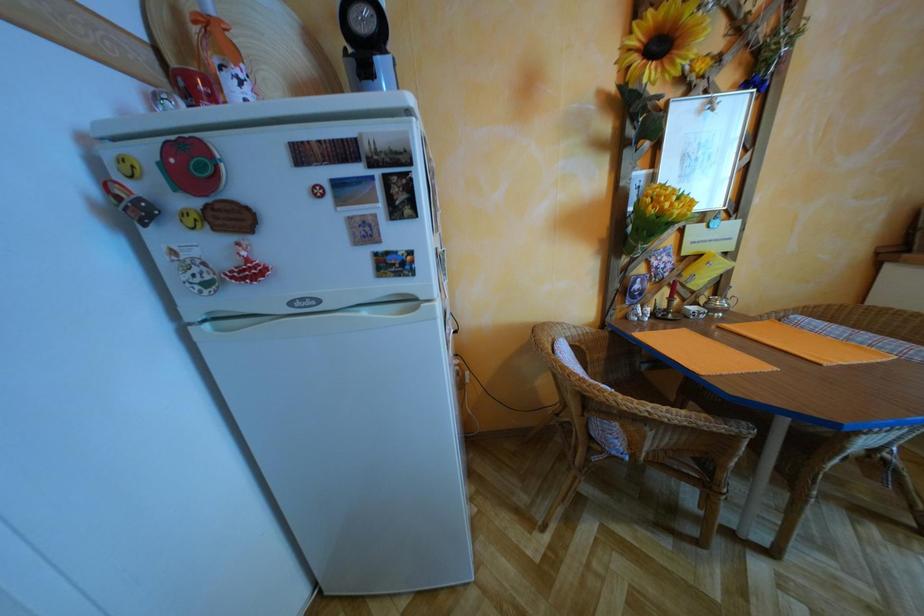
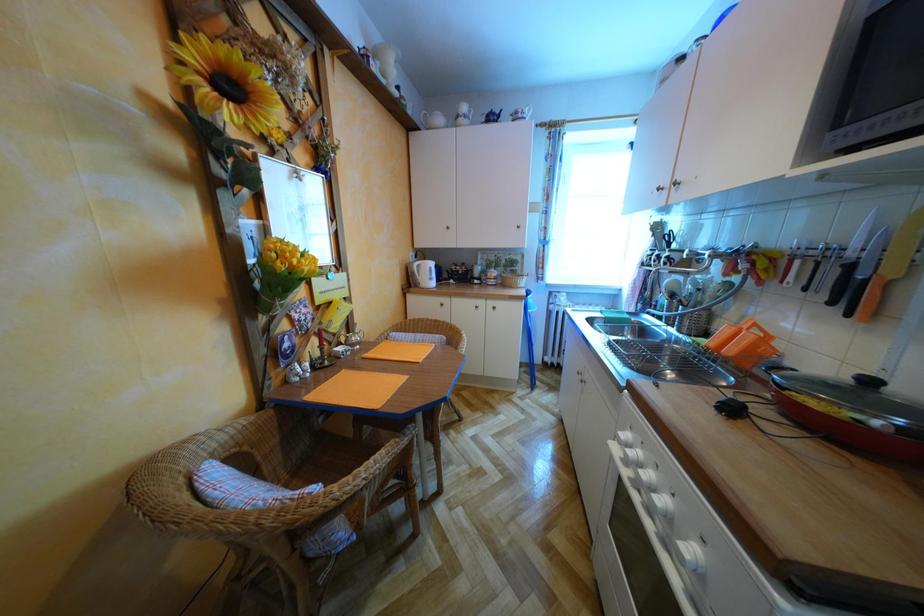
Question: The images are taken continuously from a first-person perspective. In which direction is your viewpoint rotating?

Choices:
 (A) Left
 (B) Right
 (C) Up
 (D) Down

Answer: (B)